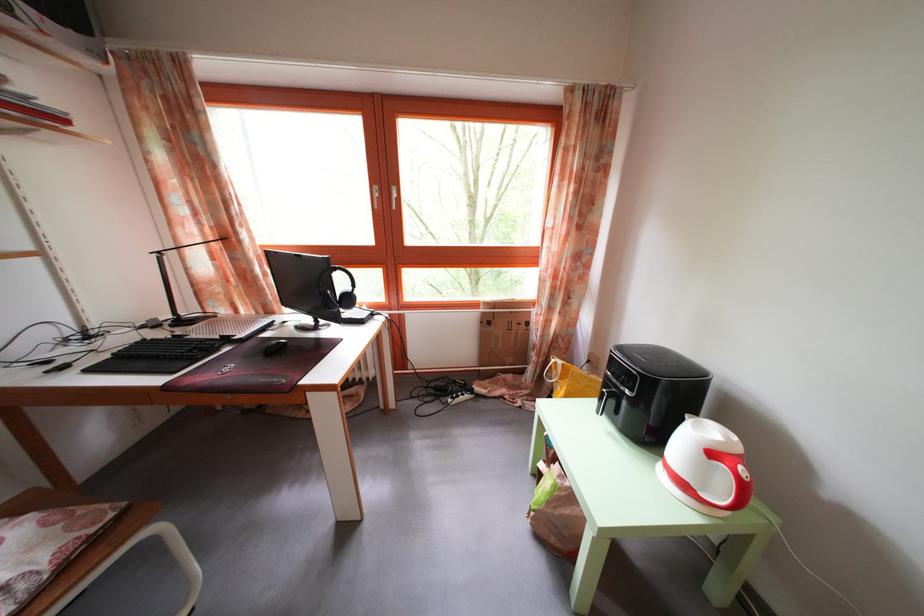
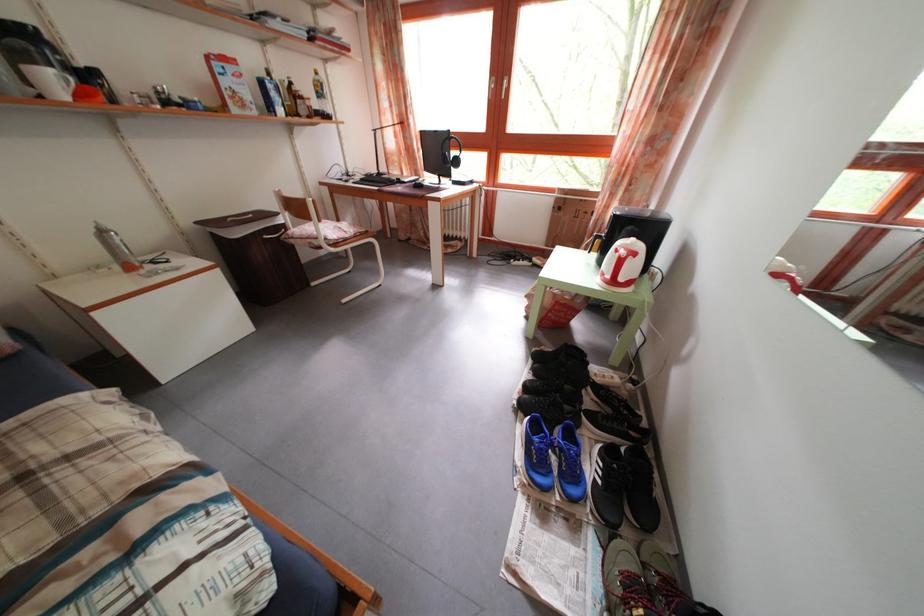
Question: I am providing you with two images of the same scene from different viewpoints. After the viewpoint changes to image2, which objects are now occluded?

Choices:
 (A) black computer mouse
 (B) black sneaker
 (C) chair sitting surface
 (D) none of these

Answer: (D)